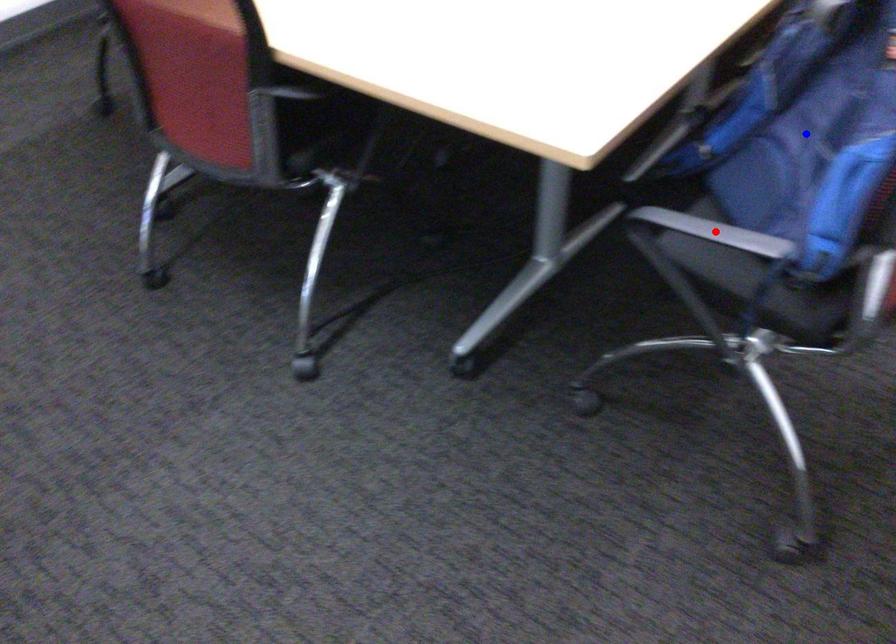
Question: Which of the two points in the image is closer to the camera?

Choices:
 (A) Blue point is closer.
 (B) Red point is closer.

Answer: (B)